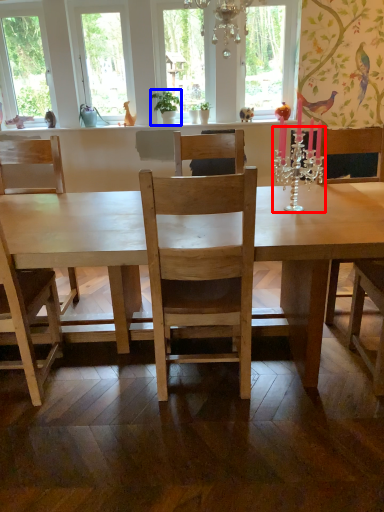
Question: Which of the following is the closest to the observer, candle holder (highlighted by a red box) or houseplant (highlighted by a blue box)?

Choices:
 (A) candle holder
 (B) houseplant

Answer: (A)